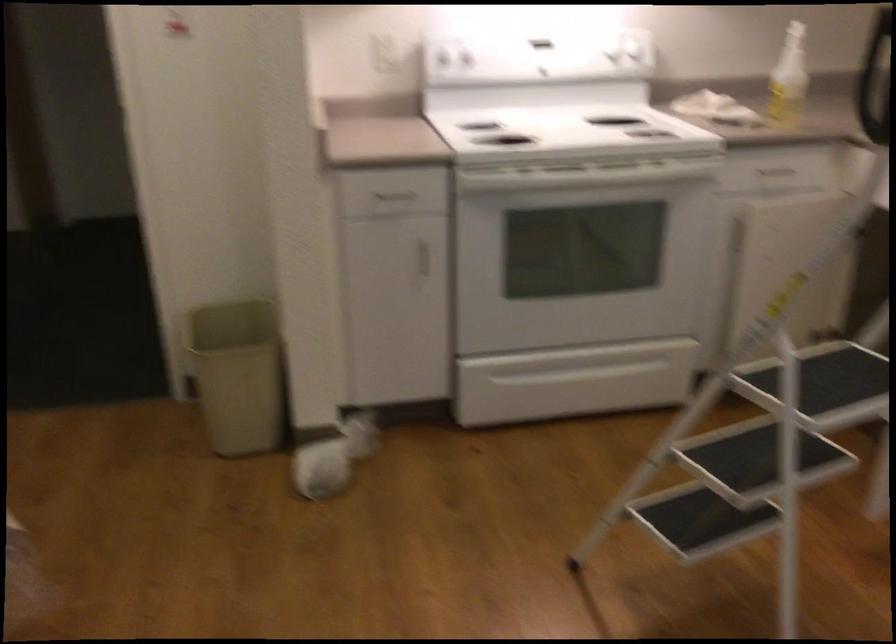
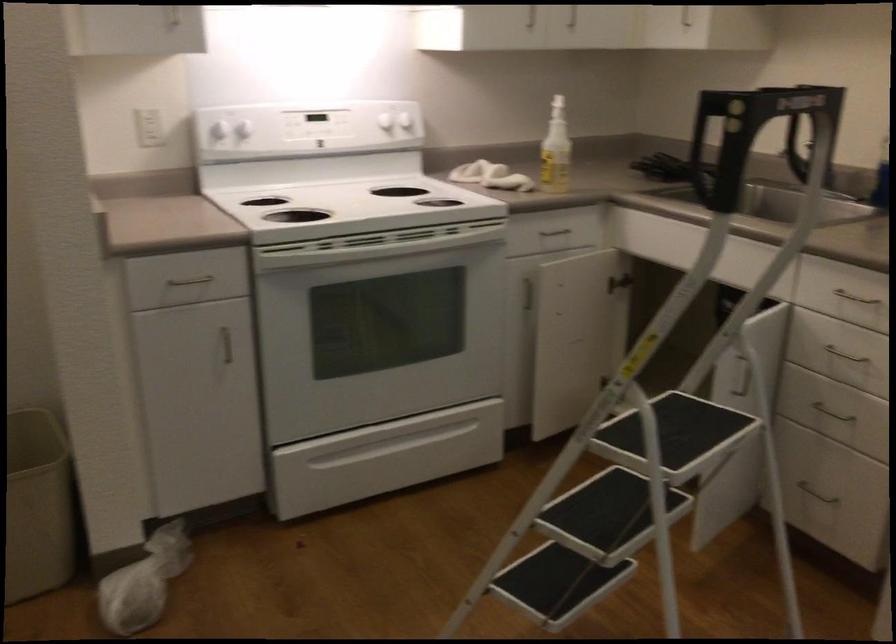
Question: The first image is from the beginning of the video and the second image is from the end. How did the camera likely rotate when shooting the video?

Choices:
 (A) Left
 (B) Right
 (C) Up
 (D) Down

Answer: (B)